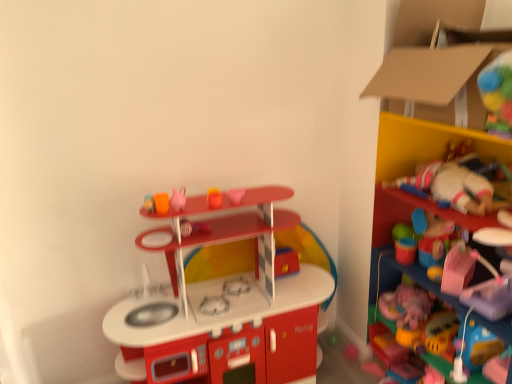
Where is `free space behind pink matte heart at upper center, which is the first toy in top-to-bottom order`? free space behind pink matte heart at upper center, which is the first toy in top-to-bottom order is located at coordinates (249, 192).